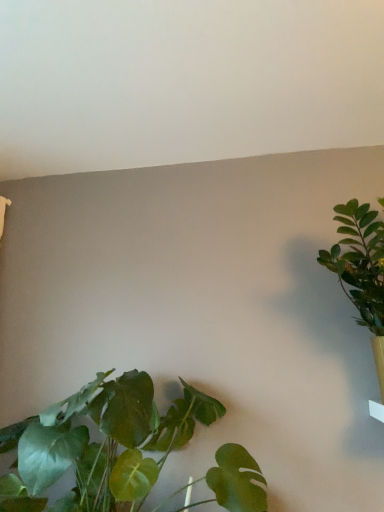
Question: In terms of size, does green leafy plant at right, positioned as the first houseplant in right-to-left order, appear bigger or smaller than green leafy plant at lower left, which is counted as the 2th houseplant, starting from the right?

Choices:
 (A) small
 (B) big

Answer: (A)

Question: From their relative heights in the image, would you say green leafy plant at right, positioned as the first houseplant in right-to-left order, is taller or shorter than green leafy plant at lower left, marked as the first houseplant in a left-to-right arrangement?

Choices:
 (A) tall
 (B) short

Answer: (A)

Question: From a real-world perspective, is green leafy plant at right, positioned as the first houseplant in right-to-left order, physically located above or below green leafy plant at lower left, which is counted as the 2th houseplant, starting from the right?

Choices:
 (A) below
 (B) above

Answer: (B)

Question: In the image, is green leafy plant at lower left, marked as the first houseplant in a left-to-right arrangement, on the left side or the right side of green leafy plant at right, positioned as the first houseplant in right-to-left order?

Choices:
 (A) right
 (B) left

Answer: (B)

Question: Is green leafy plant at lower left, which is counted as the 2th houseplant, starting from the right, bigger or smaller than green leafy plant at right, arranged as the 2th houseplant when viewed from the left?

Choices:
 (A) big
 (B) small

Answer: (A)

Question: Considering the positions of point (142, 375) and point (377, 330), is point (142, 375) closer or farther from the camera than point (377, 330)?

Choices:
 (A) closer
 (B) farther

Answer: (A)

Question: From the image's perspective, is green leafy plant at lower left, which is counted as the 2th houseplant, starting from the right, located above or below green leafy plant at right, arranged as the 2th houseplant when viewed from the left?

Choices:
 (A) above
 (B) below

Answer: (B)